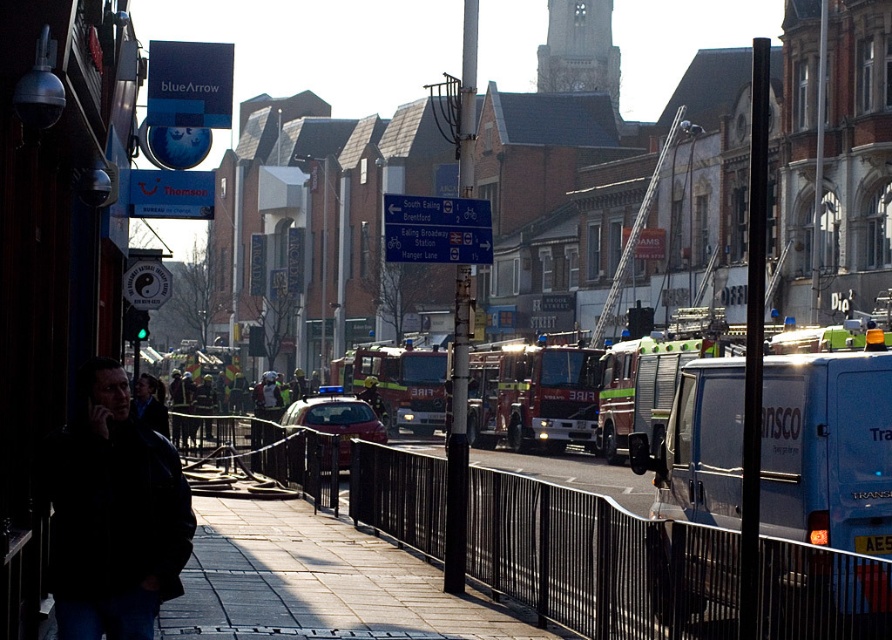
You are a delivery person who needs to place a package on the sidewalk near the blueArrow storefront. The package must be placed at point [150,403]. However, there is an object at that location. What is the object blocking the delivery location?

The dark blue jacket at lower left is located at point [150,403], so it is blocking the delivery location.

Consider the image. You are a delivery person who needs to park your 2.5 meters tall delivery van between the red glossy fire truck at center and the metallic red car at center. Can you fit your van between them without exceeding the height limit?

The red glossy fire truck at center is taller than the metallic red car at center. Since your delivery van is 2.5 meters tall, you need to check the minimum height clearance between them. However, the exact height difference isn not provided, so it is uncertain if the van will fit. Please verify the available space before proceeding.

You are a delivery person who needs to park your van between the blue metallic van at center right and the metallic red car at center. The parking space between them is 47.84 feet. Can your 15 feet long van fit comfortably with at least 5 feet of space on both ends?

The parking space between the blue metallic van at center right and the metallic red car at center is 47.84 feet. Since your van is 15 feet long, subtracting the required 5 feet of space on both ends leaves 37.84 feet, which is more than enough. Yes, the van can fit comfortably.